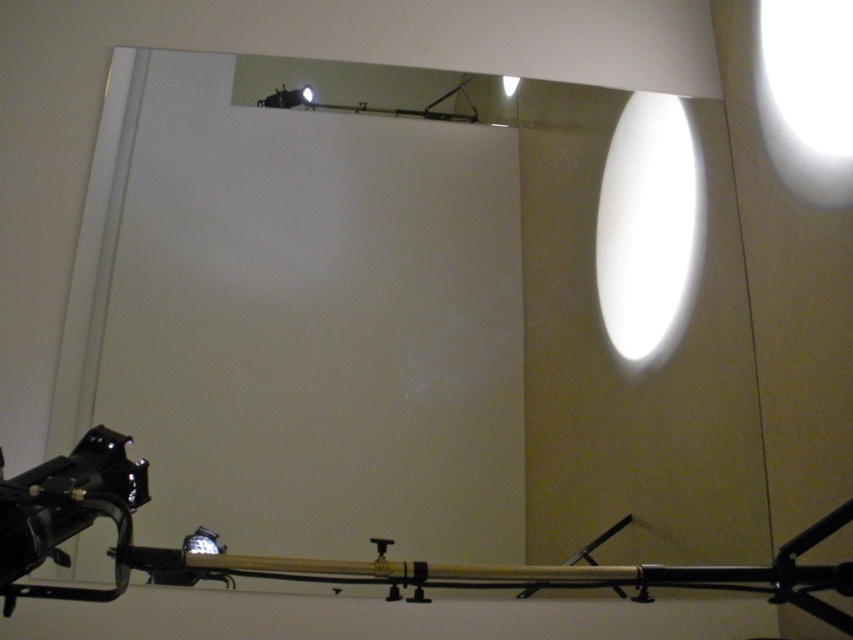
Question: Estimate the real-world distances between objects in this image. Which object is closer to the black glossy video camera at lower left?

Choices:
 (A) black metal/wooden pole at lower center
 (B) white glossy mirror at upper center
 (C) white glossy light at upper right

Answer: (A)

Question: Estimate the real-world distances between objects in this image. Which object is farther from the matte white light at upper center?

Choices:
 (A) white glossy light at upper right
 (B) black glossy video camera at lower left

Answer: (B)

Question: Does white glossy light at upper right have a smaller size compared to matte white light at upper center?

Choices:
 (A) yes
 (B) no

Answer: (B)

Question: Does white glossy mirror at upper center appear over matte white light at upper center?

Choices:
 (A) yes
 (B) no

Answer: (B)

Question: Is black glossy video camera at lower left bigger than matte white light at upper center?

Choices:
 (A) no
 (B) yes

Answer: (B)

Question: Which point is farther to the camera?

Choices:
 (A) (509, 76)
 (B) (695, 212)
 (C) (799, 136)
 (D) (816, 540)

Answer: (A)